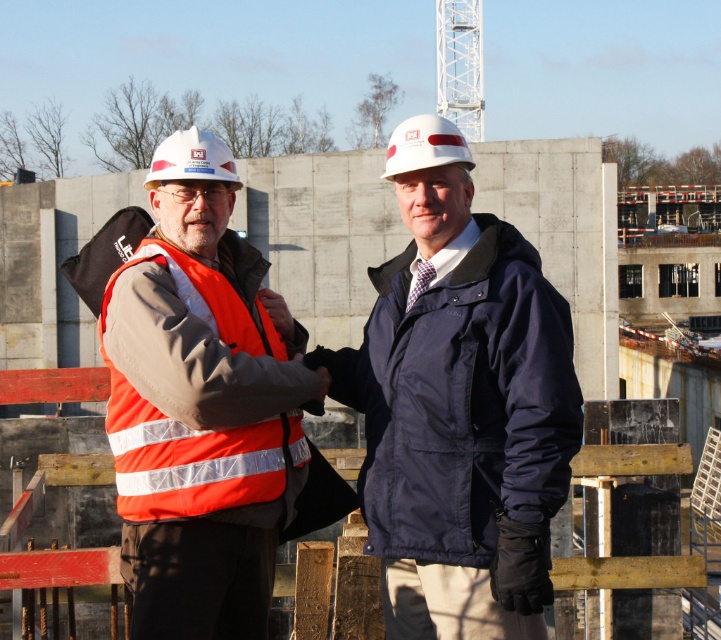
Is point (534, 356) positioned in front of point (221, 355)?

Yes, point (534, 356) is in front of point (221, 355).

Describe the element at coordinates (461, 419) in the screenshot. I see `navy blue jacket at center` at that location.

I want to click on navy blue jacket at center, so click(461, 419).

Between white matte hard hat at center and white hard hat at center, which one appears on the right side from the viewer's perspective?

white matte hard hat at center is more to the right.

Find the location of a particular element. The height and width of the screenshot is (640, 721). white matte hard hat at center is located at coordinates (425, 145).

The image size is (721, 640). Identify the location of white matte hard hat at center. (425, 145).

Who is more forward, (x=386, y=612) or (x=216, y=168)?

Point (x=216, y=168)

Is navy blue jacket at center to the right of white hard hat at center from the viewer's perspective?

Yes, navy blue jacket at center is to the right of white hard hat at center.

Does point (459, 186) come closer to viewer compared to point (172, 166)?

That is True.

Where is `navy blue jacket at center`? The image size is (721, 640). navy blue jacket at center is located at coordinates (461, 419).